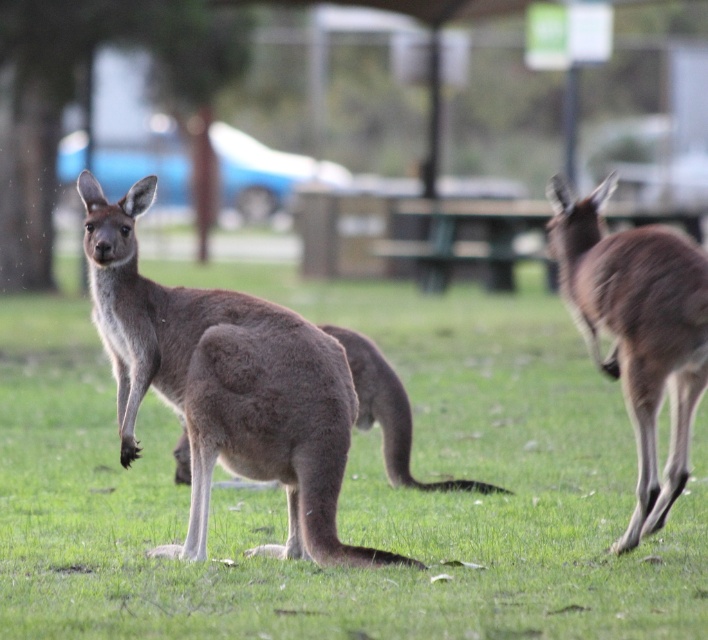
Question: Which point appears closest to the camera in this image?

Choices:
 (A) (x=525, y=387)
 (B) (x=110, y=310)
 (C) (x=624, y=301)

Answer: (C)

Question: Based on their relative distances, which object is farther from the brown furry kangaroo at center?

Choices:
 (A) gray furry kangaroo at center
 (B) brown furry kangaroo at right

Answer: (B)

Question: Can you confirm if brown furry kangaroo at center is positioned below gray furry kangaroo at center?

Choices:
 (A) no
 (B) yes

Answer: (A)

Question: Is brown furry kangaroo at center smaller than gray furry kangaroo at center?

Choices:
 (A) yes
 (B) no

Answer: (B)

Question: Among these points, which one is farthest from the camera?

Choices:
 (A) [135, 264]
 (B) [615, 548]

Answer: (B)

Question: Is brown furry kangaroo at center to the left of brown furry kangaroo at right from the viewer's perspective?

Choices:
 (A) yes
 (B) no

Answer: (A)